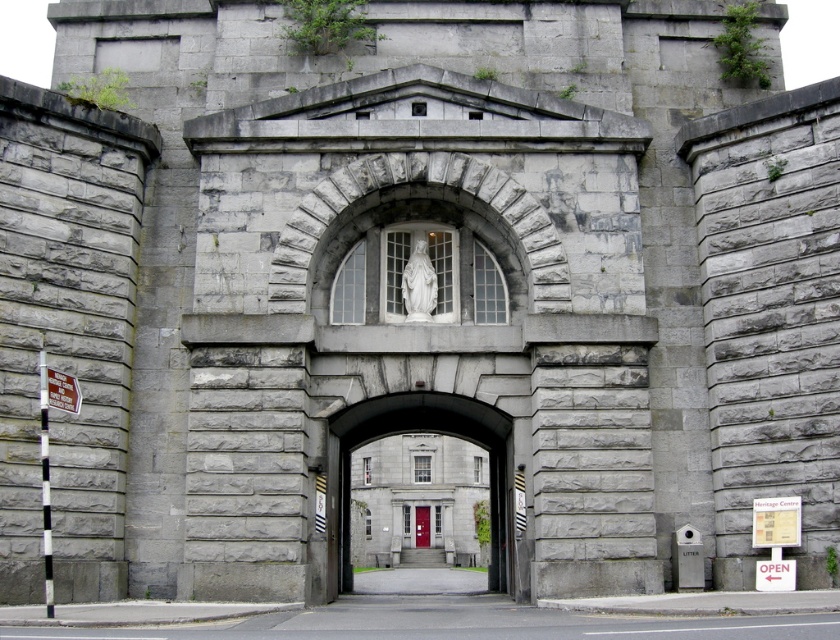
How distant is black and white striped pole at left from white plastic sign at left?

A distance of 6.49 feet exists between black and white striped pole at left and white plastic sign at left.

Does black and white striped pole at left come in front of white plastic sign at left?

Yes, it is in front of white plastic sign at left.

Image resolution: width=840 pixels, height=640 pixels. In order to click on black and white striped pole at left in this screenshot , I will do `click(48, 454)`.

Can you confirm if smooth stone archway at center is positioned above red matte door at center?

Yes.

Does smooth stone archway at center have a lesser height compared to red matte door at center?

Incorrect, smooth stone archway at center's height does not fall short of red matte door at center's.

The image size is (840, 640). What do you see at coordinates (426, 432) in the screenshot?
I see `smooth stone archway at center` at bounding box center [426, 432].

The height and width of the screenshot is (640, 840). What are the coordinates of `smooth stone archway at center` in the screenshot? It's located at (426, 432).

Who is positioned more to the left, black and white striped pole at left or red matte door at center?

black and white striped pole at left

Does black and white striped pole at left have a lesser width compared to red matte door at center?

No.

Is point (43, 513) farther from camera compared to point (426, 547)?

No, it is in front of (426, 547).

Locate an element on the screen. This screenshot has width=840, height=640. black and white striped pole at left is located at coordinates (48, 454).